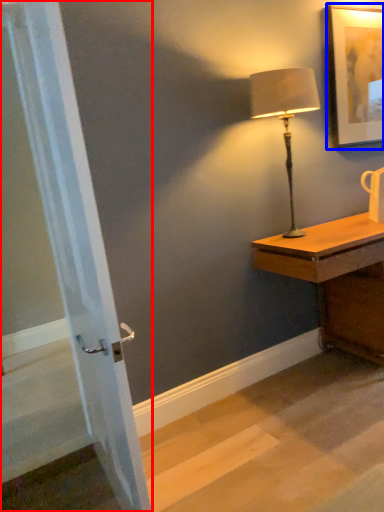
Question: Which object appears farthest to the camera in this image, screen door (highlighted by a red box) or picture frame (highlighted by a blue box)?

Choices:
 (A) screen door
 (B) picture frame

Answer: (B)